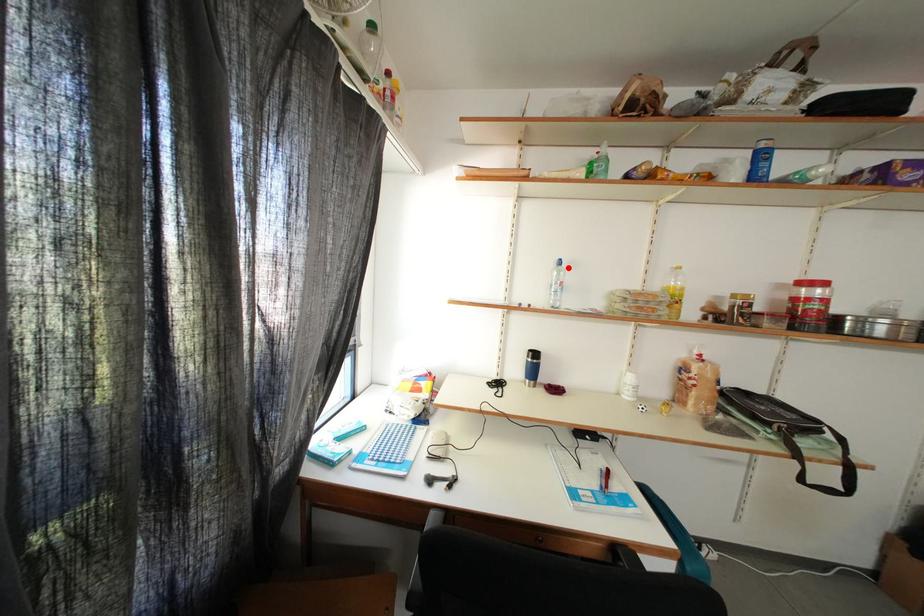
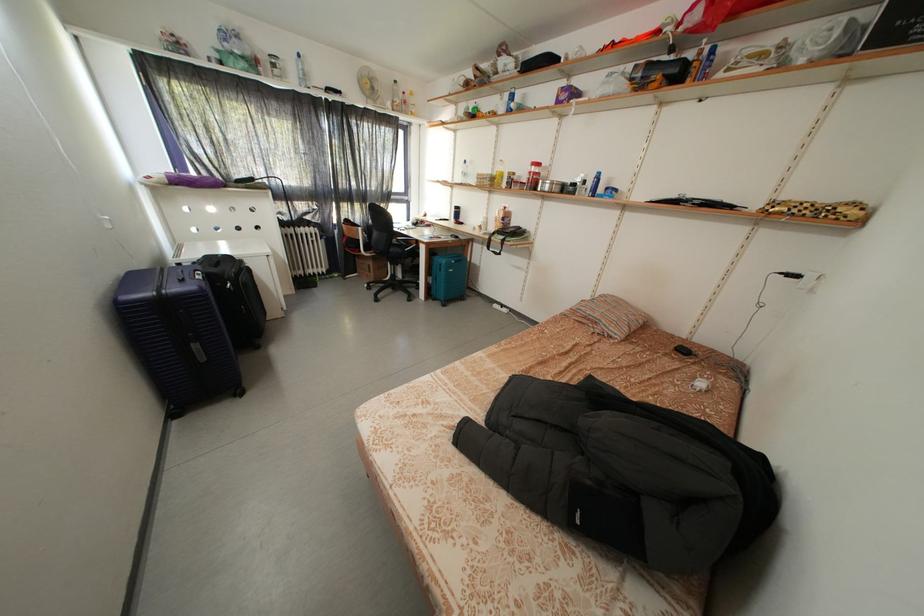
Question: I am providing you with two images of the same scene from different viewpoints. In image1, a red point is highlighted. Considering the same 3D point in image2, which of the following is correct?

Choices:
 (A) It is closer
 (B) It is farther

Answer: (A)